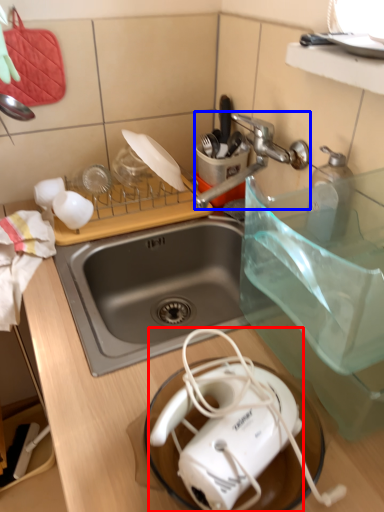
Question: Which object is further to the camera taking this photo, toaster (highlighted by a red box) or faucet (highlighted by a blue box)?

Choices:
 (A) toaster
 (B) faucet

Answer: (B)